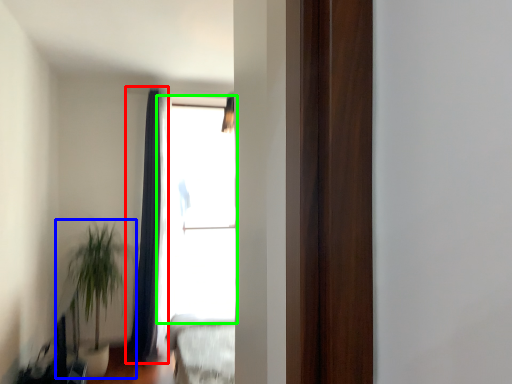
Question: Considering the real-world distances, which object is farthest from curtain (highlighted by a red box)? houseplant (highlighted by a blue box) or window (highlighted by a green box)?

Choices:
 (A) houseplant
 (B) window

Answer: (A)